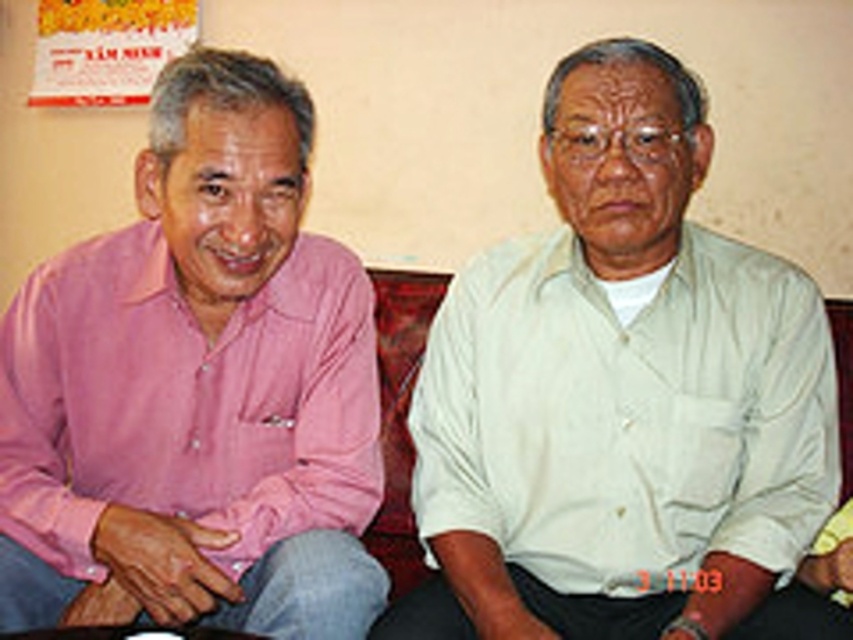
Question: Can you confirm if pink cotton shirt at left is positioned above light beige cotton shirt at right?

Choices:
 (A) yes
 (B) no

Answer: (A)

Question: Observing the image, what is the correct spatial positioning of pink cotton shirt at left in reference to light beige cotton shirt at right?

Choices:
 (A) left
 (B) right

Answer: (A)

Question: Is pink cotton shirt at left wider than light beige cotton shirt at right?

Choices:
 (A) no
 (B) yes

Answer: (A)

Question: Which point is farther to the camera?

Choices:
 (A) light beige cotton shirt at right
 (B) pink cotton shirt at left

Answer: (A)